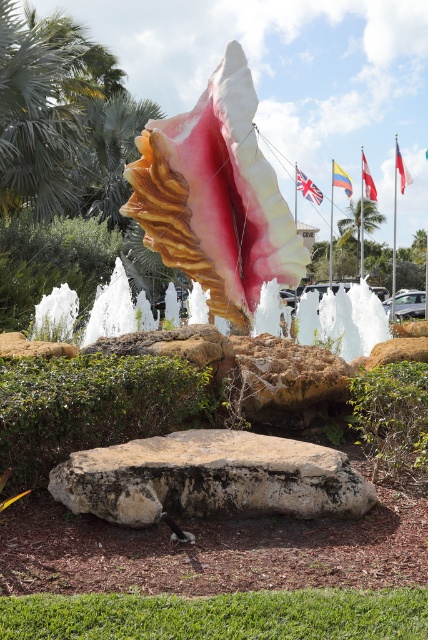
Question: Which object appears closest to the camera in this image?

Choices:
 (A) speckled beige rock at center
 (B) polyester flag at upper center
 (C) white stone fountain at center

Answer: (A)

Question: Is british flag at center smaller than red fabric flag at upper right?

Choices:
 (A) yes
 (B) no

Answer: (A)

Question: Is speckled beige rock at center above red fabric flag at upper center?

Choices:
 (A) yes
 (B) no

Answer: (B)

Question: Which point appears farthest from the camera in this image?

Choices:
 (A) (404, 168)
 (B) (374, 184)
 (C) (308, 195)

Answer: (B)

Question: Among these objects, which one is farthest from the camera?

Choices:
 (A) british flag at center
 (B) speckled beige rock at center
 (C) green leafy palm tree at upper center

Answer: (C)

Question: From the image, what is the correct spatial relationship of white stone fountain at center in relation to red fabric flag at upper center?

Choices:
 (A) left
 (B) right

Answer: (A)